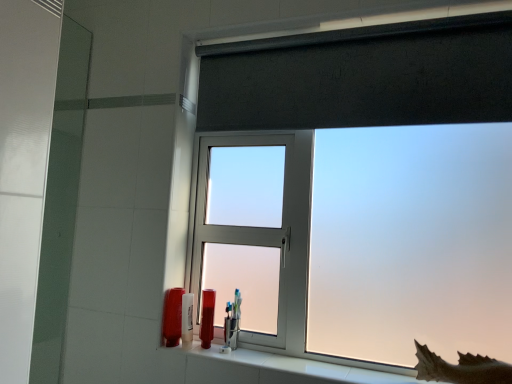
Question: Does white ceramic window sill at lower center have a greater width compared to clear plastic toothbrush holder at center, the 1th toiletry viewed from the right?

Choices:
 (A) no
 (B) yes

Answer: (B)

Question: Can you see white ceramic window sill at lower center touching clear plastic toothbrush holder at center, the fourth toiletry when ordered from left to right?

Choices:
 (A) no
 (B) yes

Answer: (A)

Question: Can we say white ceramic window sill at lower center lies outside clear plastic toothbrush holder at center, the 1th toiletry viewed from the right?

Choices:
 (A) no
 (B) yes

Answer: (B)

Question: From a real-world perspective, is white ceramic window sill at lower center below clear plastic toothbrush holder at center, the fourth toiletry when ordered from left to right?

Choices:
 (A) yes
 (B) no

Answer: (A)

Question: From the image's perspective, would you say white ceramic window sill at lower center is shown under clear plastic toothbrush holder at center, the fourth toiletry when ordered from left to right?

Choices:
 (A) no
 (B) yes

Answer: (B)

Question: Does white ceramic window sill at lower center appear on the left side of clear plastic toothbrush holder at center, the 1th toiletry viewed from the right?

Choices:
 (A) yes
 (B) no

Answer: (B)

Question: From the image's perspective, would you say matte glass screen door at left is shown under white ceramic window sill at lower center?

Choices:
 (A) yes
 (B) no

Answer: (B)

Question: Does matte glass screen door at left turn towards white ceramic window sill at lower center?

Choices:
 (A) no
 (B) yes

Answer: (B)

Question: Considering the relative sizes of matte glass screen door at left and white ceramic window sill at lower center in the image provided, is matte glass screen door at left wider than white ceramic window sill at lower center?

Choices:
 (A) no
 (B) yes

Answer: (A)

Question: Is white ceramic window sill at lower center surrounded by matte glass screen door at left?

Choices:
 (A) yes
 (B) no

Answer: (B)

Question: Are matte glass screen door at left and white ceramic window sill at lower center located far from each other?

Choices:
 (A) yes
 (B) no

Answer: (B)

Question: Considering the relative positions of matte glass screen door at left and white ceramic window sill at lower center in the image provided, is matte glass screen door at left to the right of white ceramic window sill at lower center from the viewer's perspective?

Choices:
 (A) no
 (B) yes

Answer: (A)

Question: Considering the relative sizes of translucent plastic tube at lower center, the 3th toiletry viewed from the left, and matte glass screen door at left in the image provided, is translucent plastic tube at lower center, the 3th toiletry viewed from the left, taller than matte glass screen door at left?

Choices:
 (A) yes
 (B) no

Answer: (B)